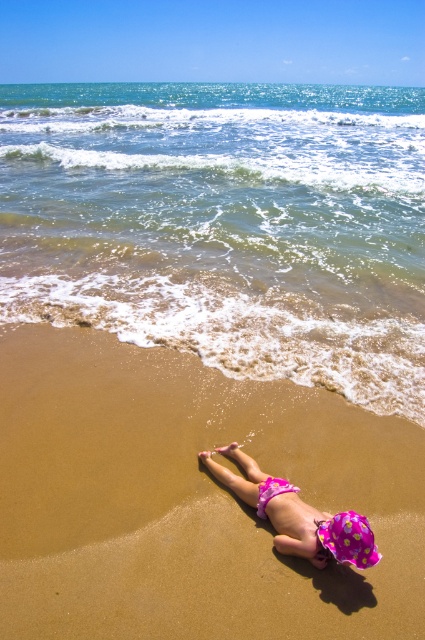
Does pink polka dot swim cap at lower center appear over pink fabric stomach at lower center?

Yes, pink polka dot swim cap at lower center is above pink fabric stomach at lower center.

The width and height of the screenshot is (425, 640). I want to click on pink polka dot swim cap at lower center, so click(297, 515).

Between clear blue water at upper center and pink fabric stomach at lower center, which one is positioned lower?

pink fabric stomach at lower center is below.

Which of these two, clear blue water at upper center or pink fabric stomach at lower center, stands shorter?

pink fabric stomach at lower center is shorter.

Does point (371, 305) come behind point (325, 518)?

Yes.

This screenshot has height=640, width=425. What are the coordinates of `clear blue water at upper center` in the screenshot? It's located at (224, 225).

From the picture: Does clear blue water at upper center appear on the left side of pink polka dot swim cap at lower center?

Indeed, clear blue water at upper center is positioned on the left side of pink polka dot swim cap at lower center.

Measure the distance from clear blue water at upper center to pink polka dot swim cap at lower center.

A distance of 38.21 feet exists between clear blue water at upper center and pink polka dot swim cap at lower center.

Who is more distant from viewer, (112, 83) or (277, 515)?

The point (112, 83) is more distant.

Identify the location of clear blue water at upper center. The height and width of the screenshot is (640, 425). (224, 225).